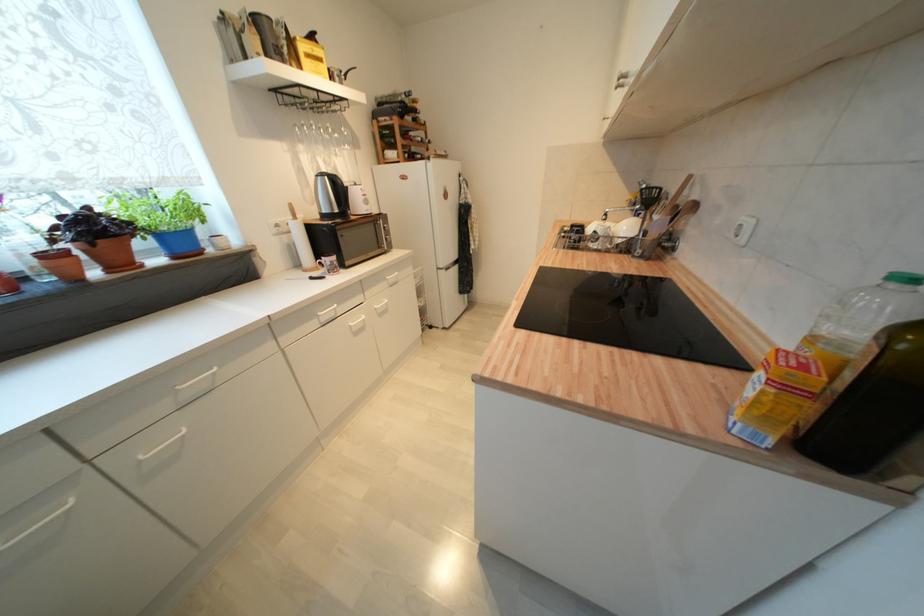
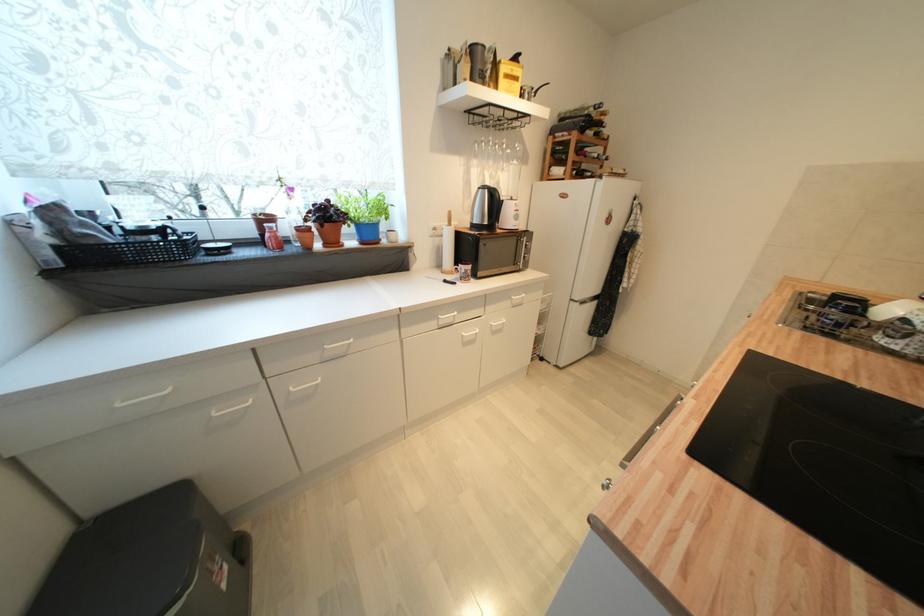
Find the pixel in the second image that matches (x=395, y=284) in the first image.

(518, 304)